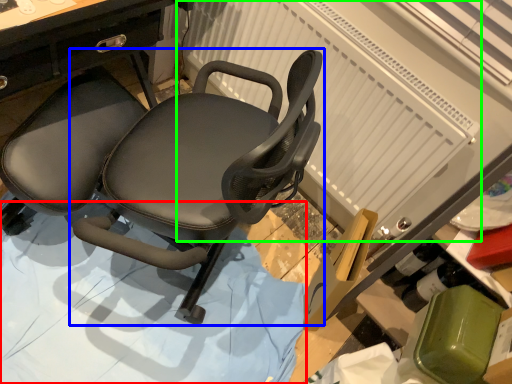
Question: Estimate the real-world distances between objects in this image. Which object is farther from surface (highlighted by a red box), chair (highlighted by a blue box) or radiator (highlighted by a green box)?

Choices:
 (A) chair
 (B) radiator

Answer: (B)